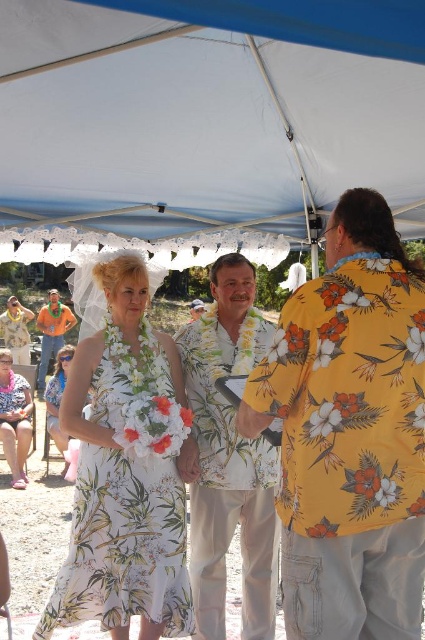
Which of these two, white floral print dress at center or orange fabric shirt at upper left, stands shorter?

white floral print dress at center

Does point (104, 483) come in front of point (45, 362)?

Yes, it is in front of point (45, 362).

Does point (152, 472) lie behind point (67, 307)?

No, it is in front of (67, 307).

At what (x,y) coordinates should I click in order to perform the action: click on white floral print dress at center. Please return your answer as a coordinate pair (x, y). The image size is (425, 640). Looking at the image, I should click on (124, 547).

Does yellow floral shirt at right come in front of orange fabric shirt at upper left?

Yes, it is in front of orange fabric shirt at upper left.

Is yellow floral shirt at right wider than orange fabric shirt at upper left?

Yes.

The image size is (425, 640). What are the coordinates of `yellow floral shirt at right` in the screenshot? It's located at (350, 433).

Image resolution: width=425 pixels, height=640 pixels. Identify the location of yellow floral shirt at right. (350, 433).

Is point (282, 396) farther from viewer compared to point (70, 616)?

No, (282, 396) is closer to viewer.

Is point (297, 531) in front of point (187, 625)?

That is True.

Which is behind, point (374, 522) or point (163, 611)?

The point (163, 611) is more distant.

In order to click on yellow floral shirt at right in this screenshot , I will do `click(350, 433)`.